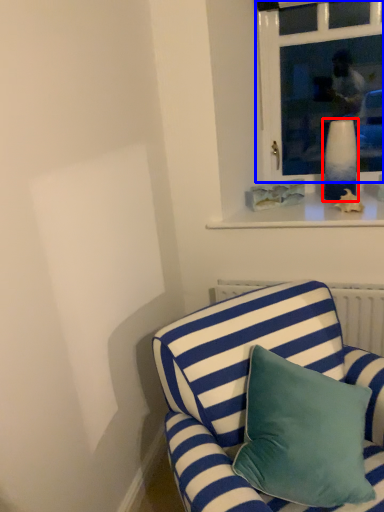
Question: Which object appears closest to the camera in this image, vase (highlighted by a red box) or window (highlighted by a blue box)?

Choices:
 (A) vase
 (B) window

Answer: (B)